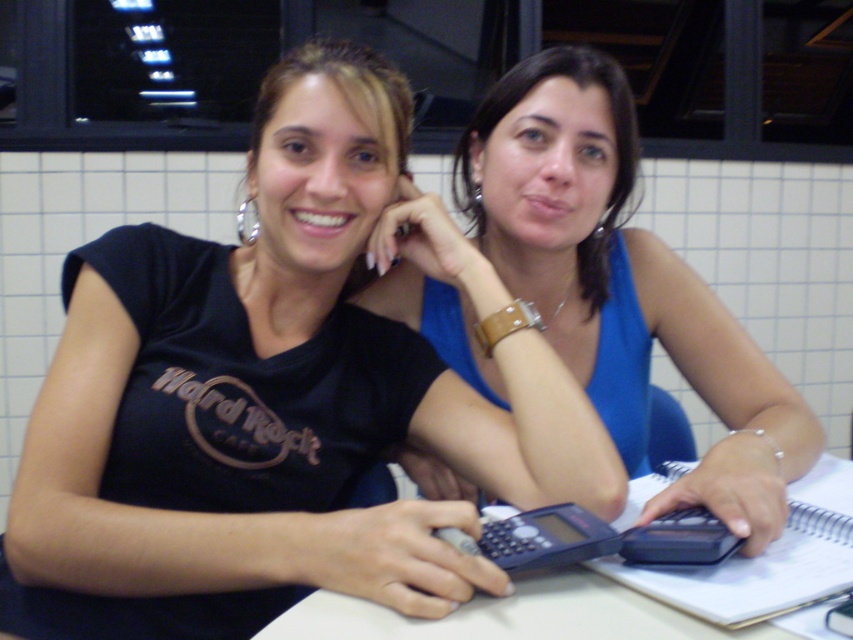
Can you confirm if blue fabric tank top at center is taller than spiral-bound paper at center?

Yes, blue fabric tank top at center is taller than spiral-bound paper at center.

Does point (734, 433) come closer to viewer compared to point (822, 547)?

No.

Locate an element on the screen. The width and height of the screenshot is (853, 640). blue fabric tank top at center is located at coordinates (622, 284).

Can you confirm if black matte calculator at center is thinner than white plastic table at center?

Correct, black matte calculator at center's width is less than white plastic table at center's.

Is point (428, 522) in front of point (749, 634)?

That is False.

You are a GUI agent. You are given a task and a screenshot of the screen. Output one action in this format:
    pyautogui.click(x=<x>, y=<y>)
    Task: Click on the black matte calculator at center
    
    Given the screenshot: What is the action you would take?
    pyautogui.click(x=277, y=396)

At what (x,y) coordinates should I click in order to perform the action: click on black matte calculator at center. Please return your answer as a coordinate pair (x, y). The width and height of the screenshot is (853, 640). Looking at the image, I should click on (277, 396).

Can you confirm if black matte calculator at center is smaller than blue fabric tank top at center?

No.

Who is positioned more to the left, black matte calculator at center or blue fabric tank top at center?

Positioned to the left is black matte calculator at center.

Which is in front, point (498, 428) or point (560, 83)?

Point (498, 428)

Identify the location of black matte calculator at center. The width and height of the screenshot is (853, 640). (277, 396).